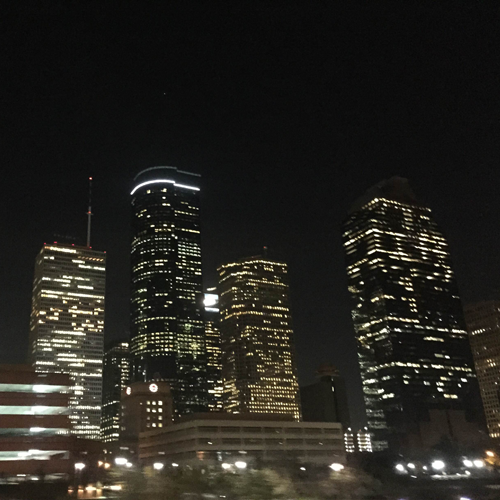
I want to click on square window, so click(160, 404).